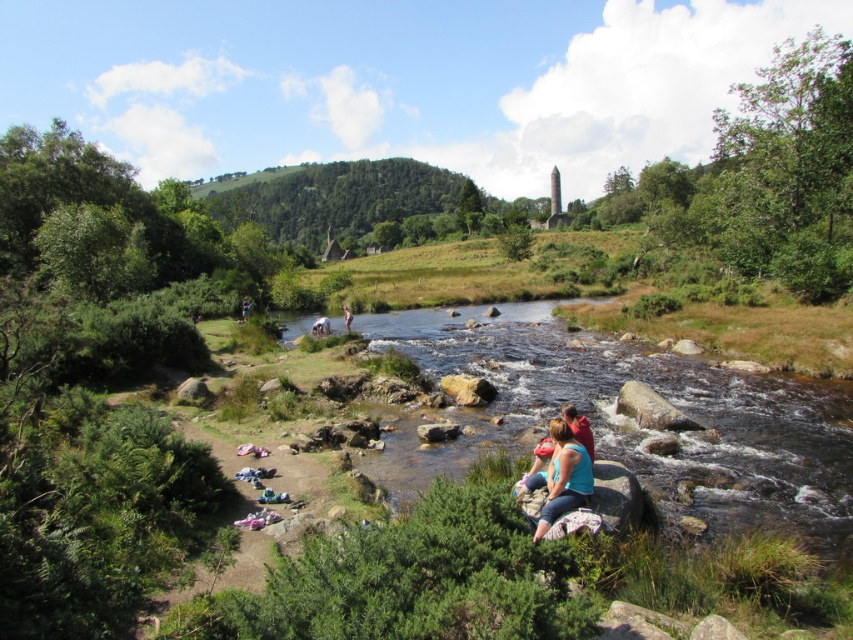
You are planning to cross the river using the fabrics as stepping stones. Given that the blue fabric at center and the light brown fabric at river center are both submerged in the water, which fabric would provide a narrower stepping area for your foot?

The blue fabric at center has a lesser width compared to the light brown fabric at river center, so it would provide a narrower stepping area for your foot.

You are standing at the edge of the river in the scene and want to reach both the point at coordinates [520,356] and the point at [572,502]. Which point will you reach first as you walk along the riverbank?

You will reach the point at coordinates [520,356] first because it is closer to you than the point at [572,502], which is further away.

You are standing on the riverbank and see the blue fabric at center and the light brown fabric at river center. Which fabric is nearer to you?

The blue fabric at center is closer to the viewer than the light brown fabric at river center.